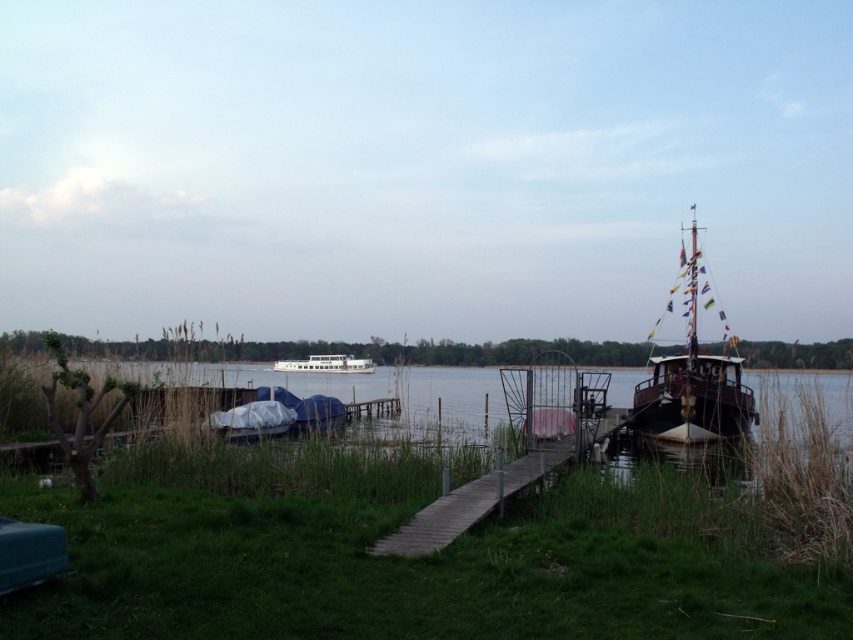
Does clear water at center appear over wooden at center?

No, clear water at center is not above wooden at center.

Does clear water at center have a smaller size compared to wooden at center?

No, clear water at center is not smaller than wooden at center.

Between point (408, 385) and point (473, 484), which one is positioned behind?

Positioned behind is point (408, 385).

Where is `clear water at center`? clear water at center is located at coordinates (363, 394).

Does wooden sailboat at right have a lesser height compared to white glossy ferry at center?

No, wooden sailboat at right is not shorter than white glossy ferry at center.

Describe the element at coordinates (692, 380) in the screenshot. Image resolution: width=853 pixels, height=640 pixels. I see `wooden sailboat at right` at that location.

Find the location of a particular element. The height and width of the screenshot is (640, 853). wooden sailboat at right is located at coordinates (692, 380).

Does wooden at center have a greater height compared to white glossy ferry at center?

Incorrect, wooden at center's height is not larger of white glossy ferry at center's.

Can you confirm if wooden at center is wider than white glossy ferry at center?

Incorrect, wooden at center's width does not surpass white glossy ferry at center's.

Does point (509, 490) lie behind point (334, 369)?

No.

What are the coordinates of `wooden at center` in the screenshot? It's located at (471, 502).